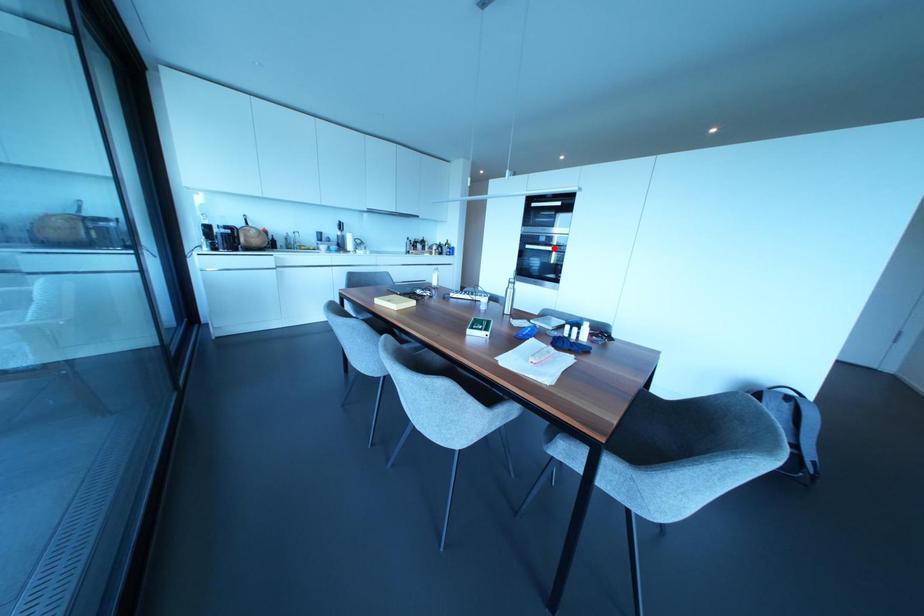
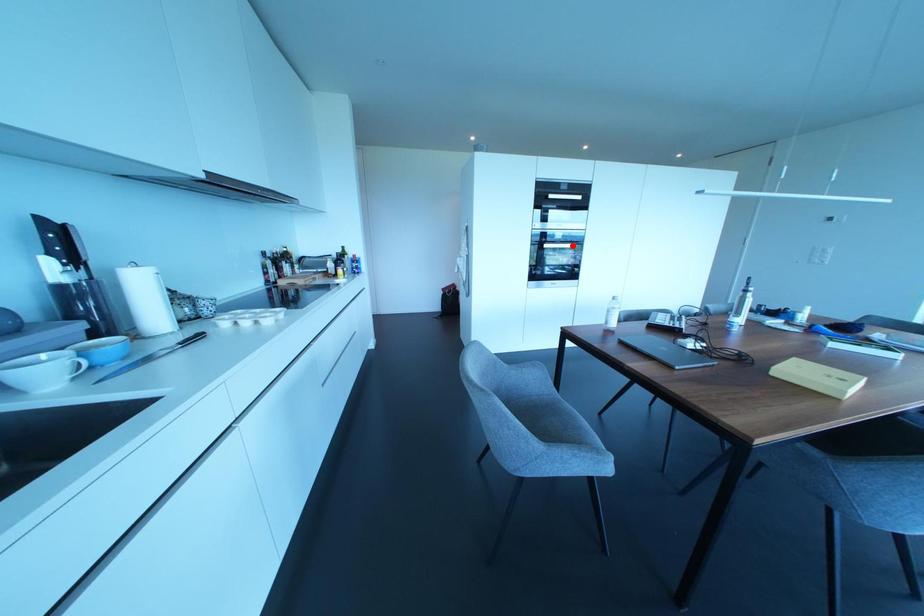
I am providing you with two images of the same scene from different viewpoints. A red point is marked on the first image and another point is marked on the second image. Do the highlighted points in image1 and image2 indicate the same real-world spot?

Yes